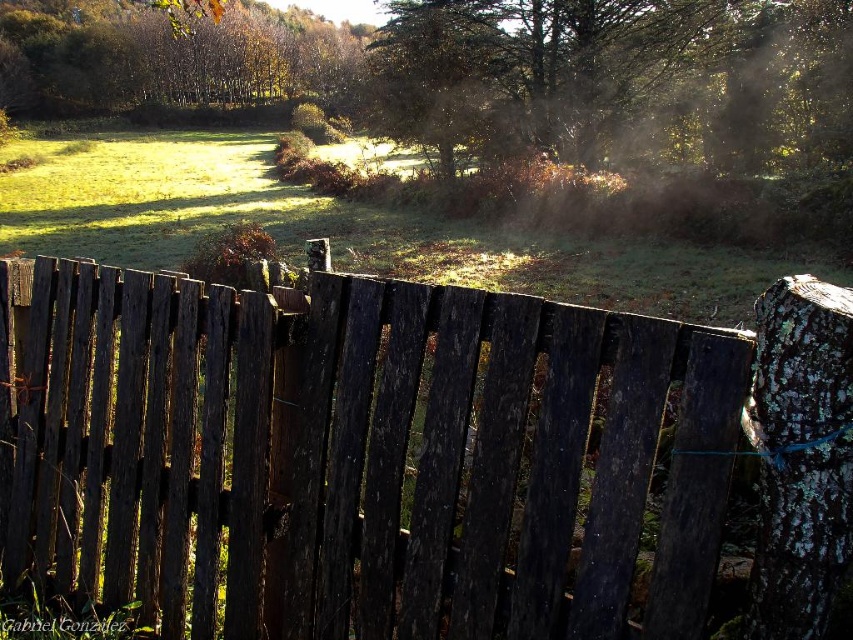
Can you confirm if weathered wood fence at center is thinner than green leafy tree at upper left?

Indeed, weathered wood fence at center has a lesser width compared to green leafy tree at upper left.

Between weathered wood fence at center and green leafy tree at upper left, which one is positioned lower?

Positioned lower is weathered wood fence at center.

Is point (529, 500) more distant than point (36, 60)?

No, it is not.

Identify the location of weathered wood fence at center. The image size is (853, 640). (357, 454).